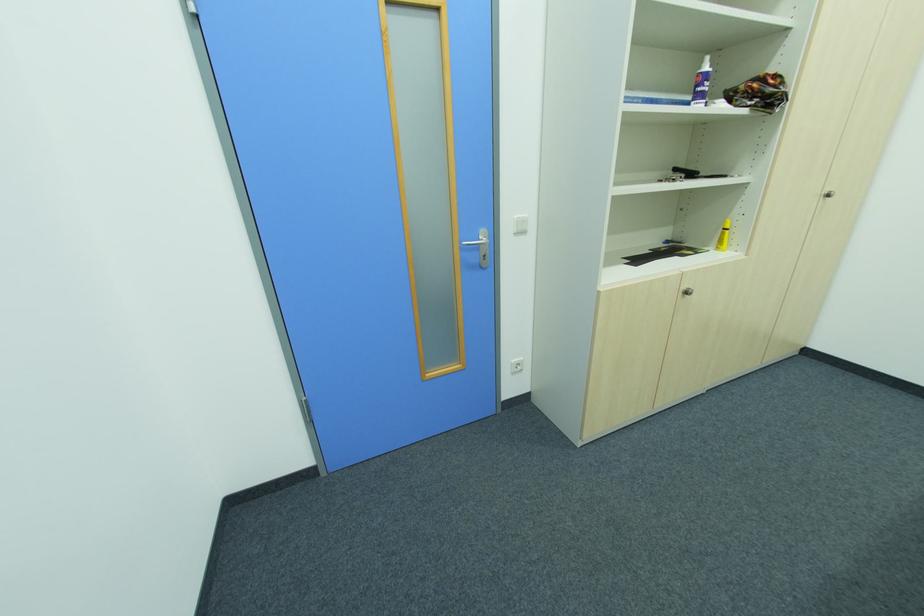
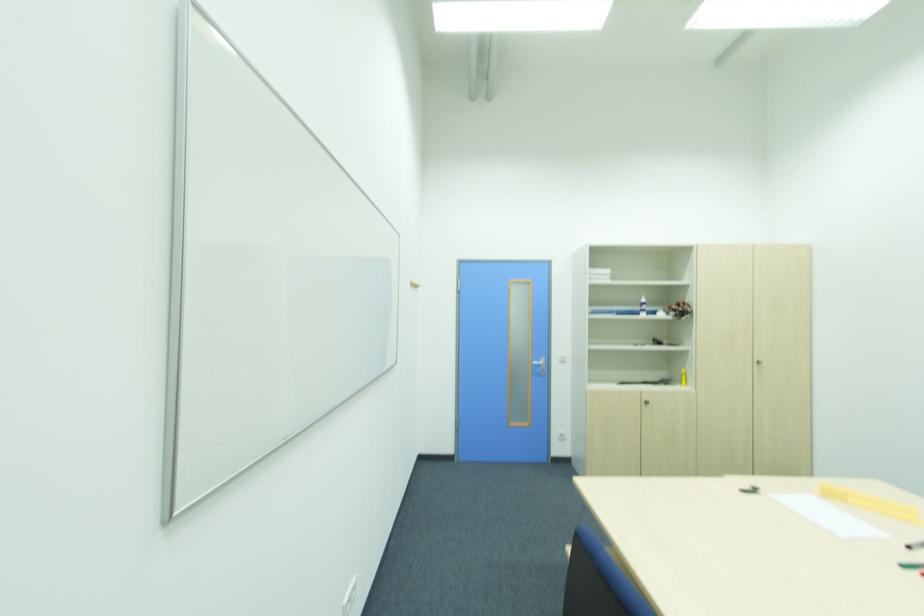
Where in the second image is the point corresponding to point (703, 68) from the first image?

(643, 301)